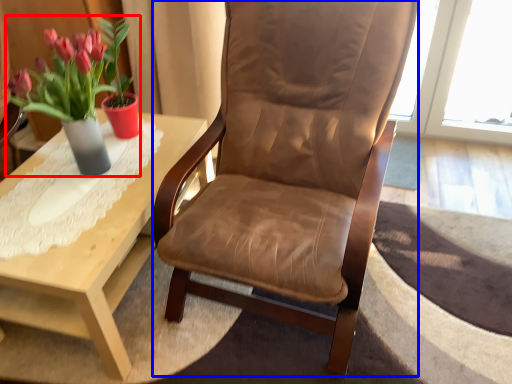
Question: Which object is further to the camera taking this photo, houseplant (highlighted by a red box) or chair (highlighted by a blue box)?

Choices:
 (A) houseplant
 (B) chair

Answer: (A)